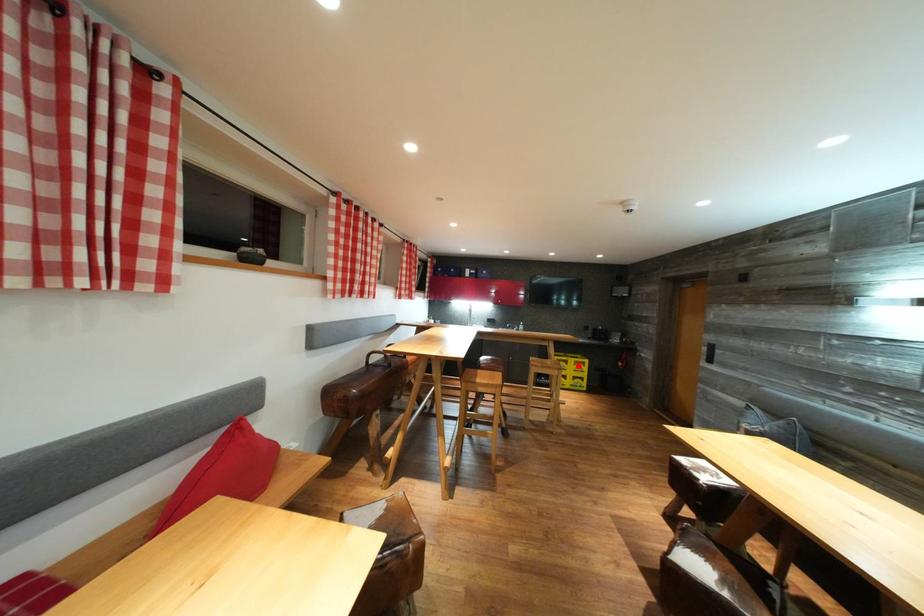
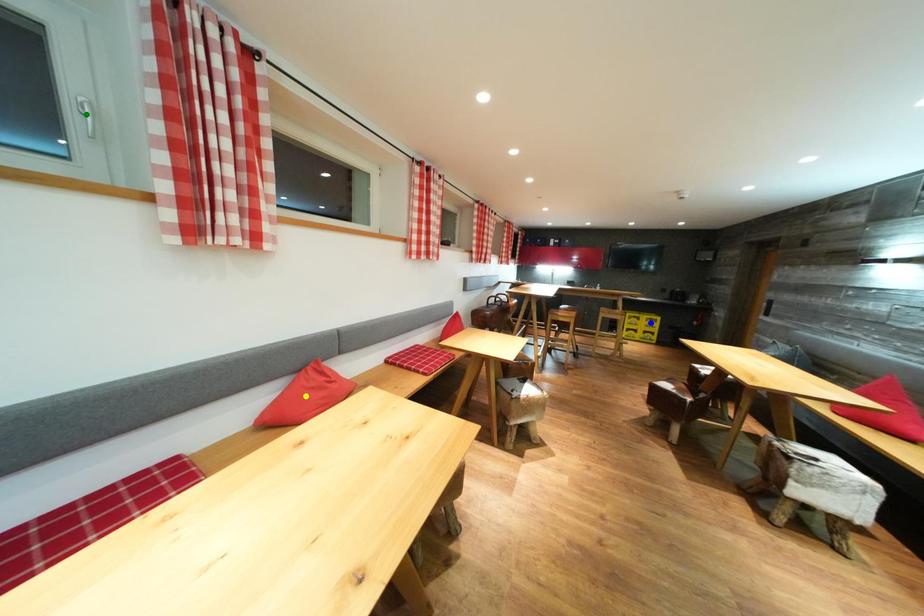
Question: I am providing you with two images of the same scene from different viewpoints. A red point is marked on the first image. You are given multiple points on the second image. Which mark in image 2 goes with the point in image 1?

Choices:
 (A) yellow point
 (B) blue point
 (C) green point

Answer: (B)